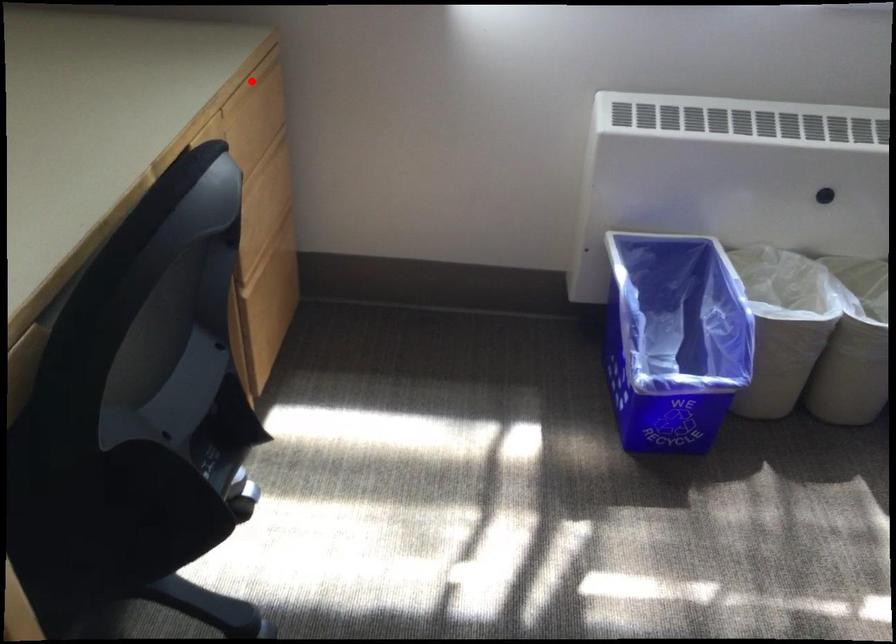
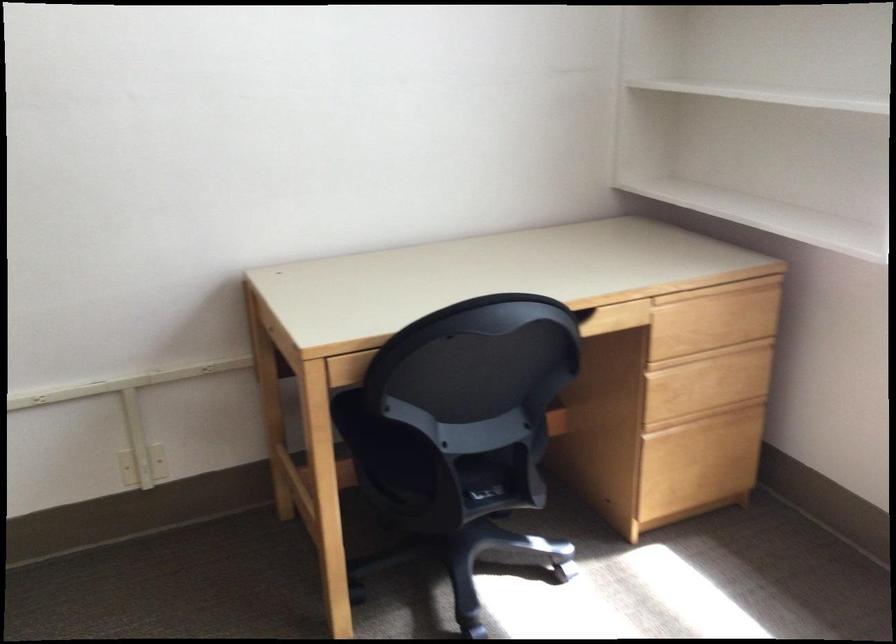
Find the pixel in the second image that matches the highlighted location in the first image.

(720, 287)